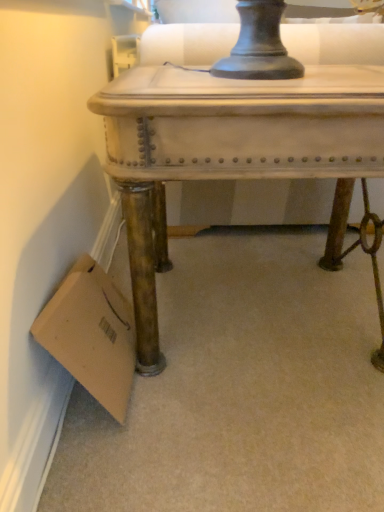
Question: Considering the positions of point 102,94 and point 115,302, is point 102,94 closer or farther from the camera than point 115,302?

Choices:
 (A) farther
 (B) closer

Answer: (B)

Question: From a real-world perspective, is distressed white table at center above or below brown cardboard at lower left?

Choices:
 (A) below
 (B) above

Answer: (B)

Question: Is distressed white table at center inside or outside of brown cardboard at lower left?

Choices:
 (A) inside
 (B) outside

Answer: (B)

Question: Is point (114, 382) positioned closer to the camera than point (144, 243)?

Choices:
 (A) closer
 (B) farther

Answer: (B)

Question: Looking at the image, does brown cardboard at lower left seem bigger or smaller compared to distressed white table at center?

Choices:
 (A) small
 (B) big

Answer: (A)

Question: In terms of width, does brown cardboard at lower left look wider or thinner when compared to distressed white table at center?

Choices:
 (A) thin
 (B) wide

Answer: (A)

Question: In terms of height, does brown cardboard at lower left look taller or shorter compared to distressed white table at center?

Choices:
 (A) tall
 (B) short

Answer: (B)